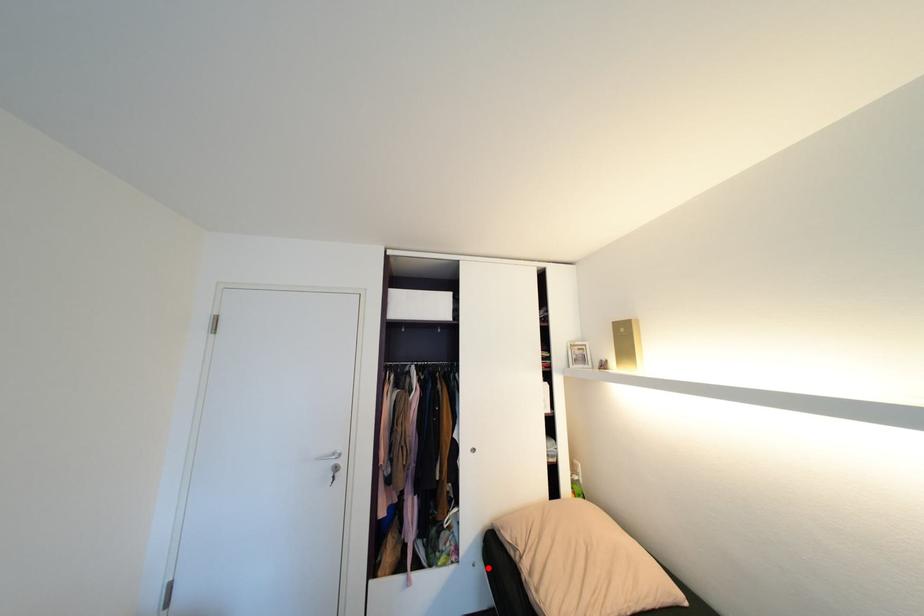
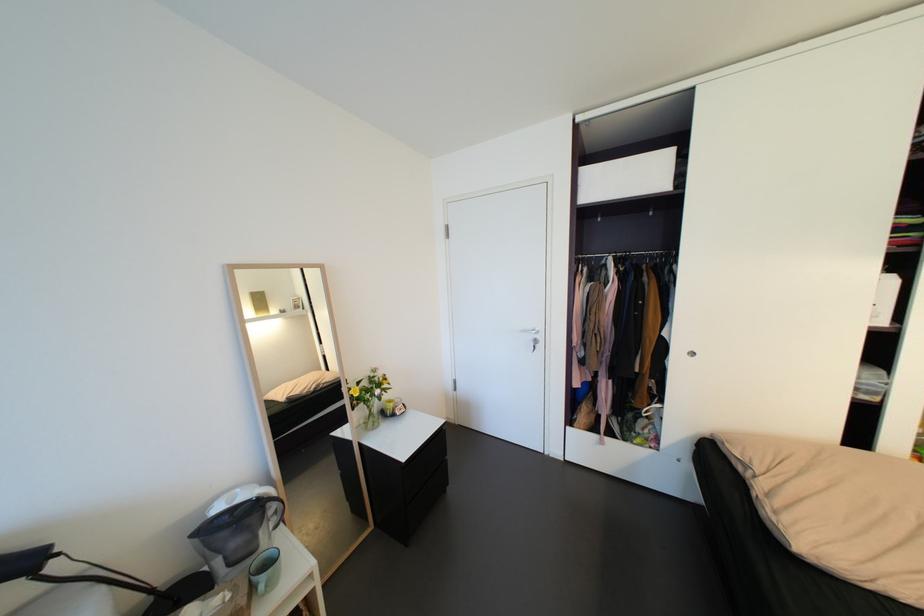
Question: I am providing you with two images of the same scene from different viewpoints. A red point is shown in image1. For the corresponding object point in image2, is it positioned nearer or farther from the camera?

Choices:
 (A) Nearer
 (B) Farther

Answer: (A)